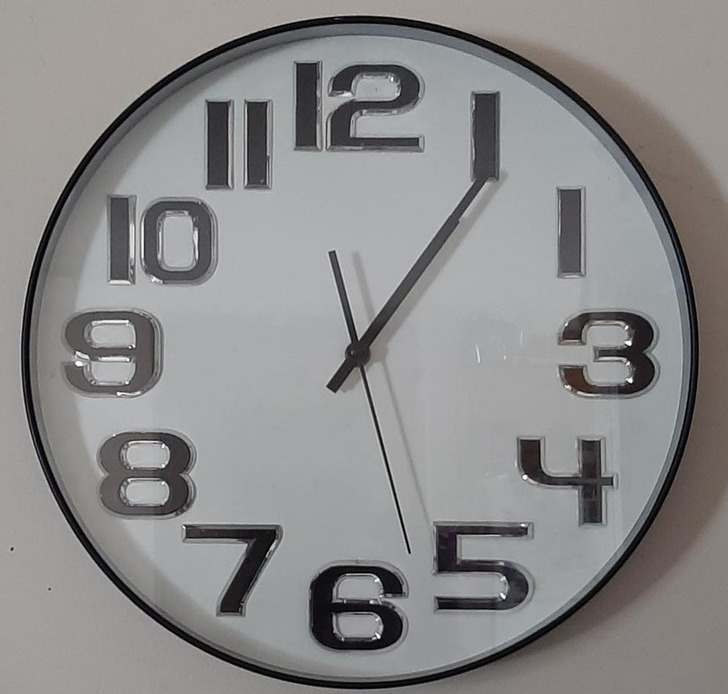
In order to click on wall in this screenshot , I will do coord(25,167).